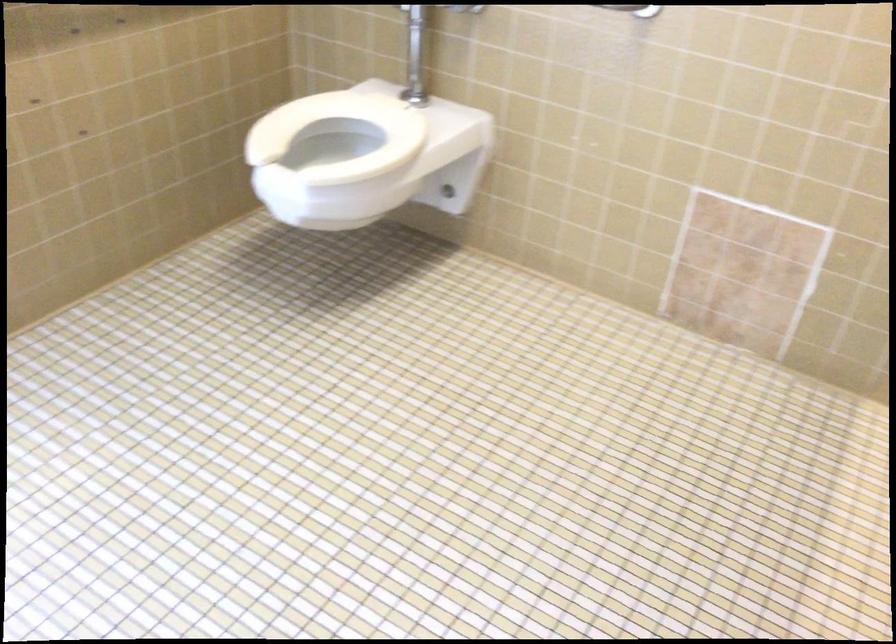
What are the coordinates of `white toilet seat` in the screenshot? It's located at pos(339,134).